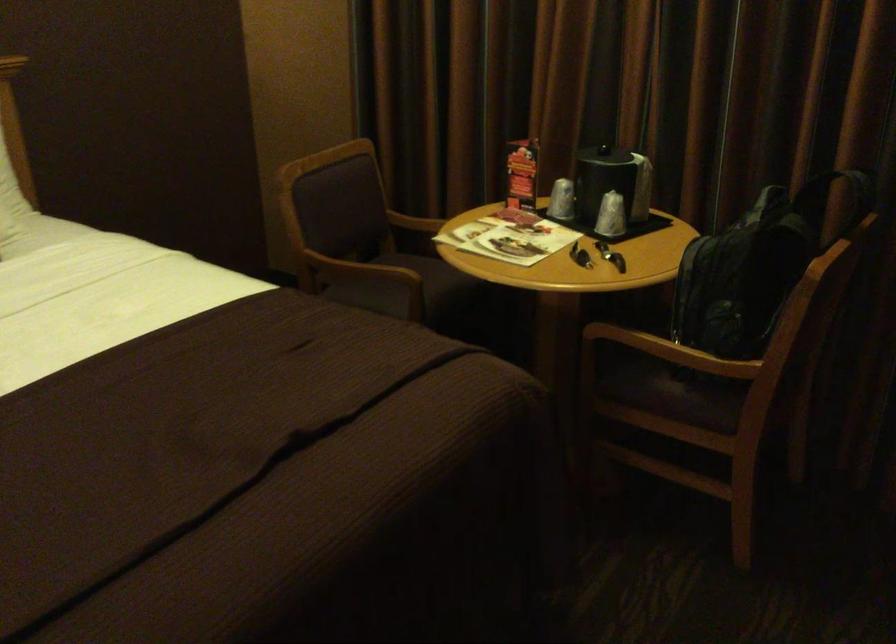
The location [757,259] corresponds to which object?

It corresponds to the black backpack in the image.